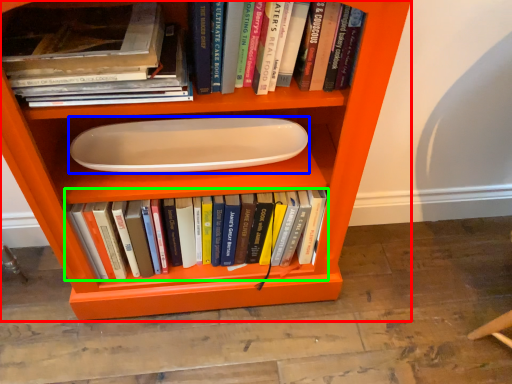
Question: Considering the real-world distances, which object is farthest from shelf (highlighted by a red box)? paper plate (highlighted by a blue box) or book (highlighted by a green box)?

Choices:
 (A) paper plate
 (B) book

Answer: (A)